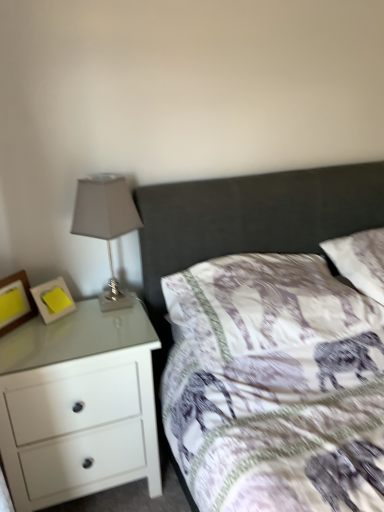
Find the location of a particular element. This screenshot has height=512, width=384. free location in front of yellow paper at left, marked as the 1th picture frame in a right-to-left arrangement is located at coordinates (46, 338).